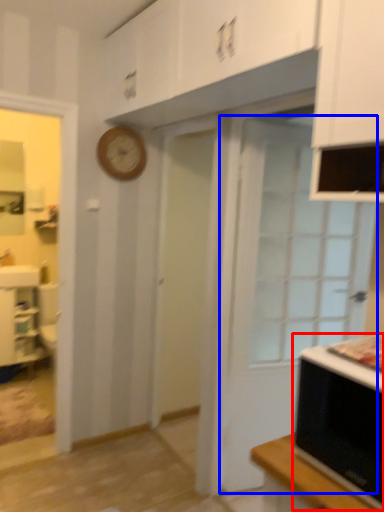
Question: Among these objects, which one is nearest to the camera, microwave oven (highlighted by a red box) or door (highlighted by a blue box)?

Choices:
 (A) microwave oven
 (B) door

Answer: (A)